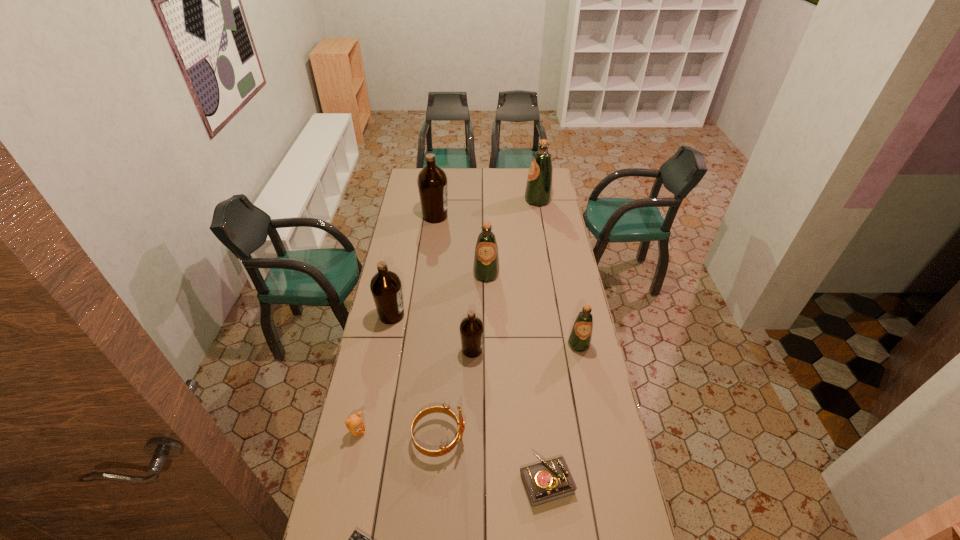
Where is `object that is the sixth closest one to the diary`? This screenshot has width=960, height=540. object that is the sixth closest one to the diary is located at coordinates point(386,288).

Identify which object is located as the fifth nearest to the fourth farthest object. Please provide its 2D coordinates. Your answer should be formatted as a tuple, i.e. [(x, y)], where the tuple contains the x and y coordinates of a point satisfying the conditions above.

[(432, 181)]

Identify which olive oil is located as the fifth nearest to the red tiara. Please provide its 2D coordinates. Your answer should be formatted as a tuple, i.e. [(x, y)], where the tuple contains the x and y coordinates of a point satisfying the conditions above.

[(432, 181)]

Choose which olive oil is the fourth nearest neighbor to the tiara. Please provide its 2D coordinates. Your answer should be formatted as a tuple, i.e. [(x, y)], where the tuple contains the x and y coordinates of a point satisfying the conditions above.

[(486, 260)]

Locate an element on the screen. Image resolution: width=960 pixels, height=540 pixels. the closest green olive oil to the smallest green olive oil is located at coordinates (486, 260).

Select which green olive oil appears as the closest to the red tiara. Please provide its 2D coordinates. Your answer should be formatted as a tuple, i.e. [(x, y)], where the tuple contains the x and y coordinates of a point satisfying the conditions above.

[(580, 338)]

Where is `brown olive oil identified as the second closest to the third farthest object`? The image size is (960, 540). brown olive oil identified as the second closest to the third farthest object is located at coordinates (471, 328).

This screenshot has width=960, height=540. What are the coordinates of `brown olive oil that can be found as the closest to the farthest brown olive oil` in the screenshot? It's located at [x=386, y=288].

This screenshot has width=960, height=540. Identify the location of vacant space that satisfies the following two spatial constraints: 1. on the front-facing side of the second biggest green olive oil; 2. on the front-facing side of the tiara. (489, 438).

Identify the location of vacant space that satisfies the following two spatial constraints: 1. on the label of the nearest brown olive oil; 2. on the right side of the ninth tallest object. [470, 482].